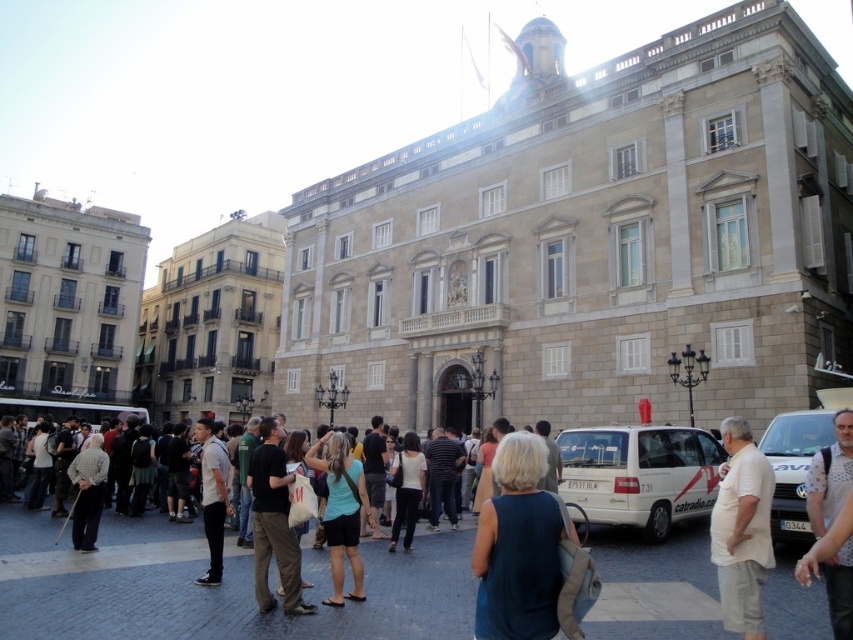
Question: Can you confirm if white matte van at lower right is positioned to the right of white textured shirt at center?

Choices:
 (A) yes
 (B) no

Answer: (A)

Question: Does white matte van at lower right appear on the right side of light blue shirt at center?

Choices:
 (A) no
 (B) yes

Answer: (B)

Question: Which point is closer to the camera?

Choices:
 (A) light blue shirt at center
 (B) dark blue sleeveless top at center

Answer: (B)

Question: Which point is closer to the camera?

Choices:
 (A) white matte van at lower right
 (B) beige cotton shirt at lower right

Answer: (B)

Question: Which of the following is the closest to the observer?

Choices:
 (A) (596, 515)
 (B) (340, 602)
 (C) (503, 589)
 (D) (202, 470)

Answer: (C)

Question: Does dark brown leather pants at center have a smaller size compared to white textured shirt at center?

Choices:
 (A) no
 (B) yes

Answer: (B)